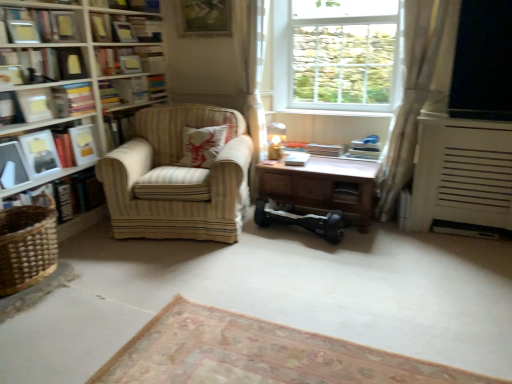
Identify the location of vacant area to the left of white plastic radiator at right. click(x=401, y=243).